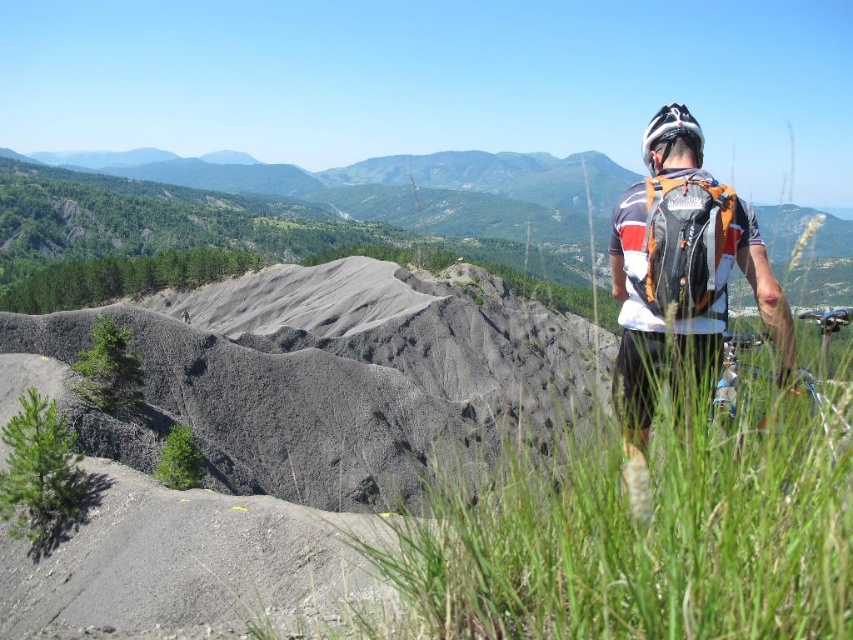
Question: Based on their relative distances, which object is nearer to the white matte bicycle helmet at upper right?

Choices:
 (A) shiny metallic bicycle at right
 (B) green grass at lower right

Answer: (B)

Question: Which of the following is the farthest from the observer?

Choices:
 (A) (689, 125)
 (B) (728, 339)

Answer: (B)

Question: Does shiny metallic bicycle at right appear on the left side of white matte bicycle helmet at upper right?

Choices:
 (A) no
 (B) yes

Answer: (A)

Question: Estimate the real-world distances between objects in this image. Which object is farther from the green grass at lower right?

Choices:
 (A) white matte bicycle helmet at upper right
 (B) shiny metallic bicycle at right

Answer: (B)

Question: Considering the relative positions of green grass at lower right and shiny metallic bicycle at right in the image provided, where is green grass at lower right located with respect to shiny metallic bicycle at right?

Choices:
 (A) above
 (B) below

Answer: (B)

Question: Is green grass at lower right bigger than white matte bicycle helmet at upper right?

Choices:
 (A) no
 (B) yes

Answer: (A)